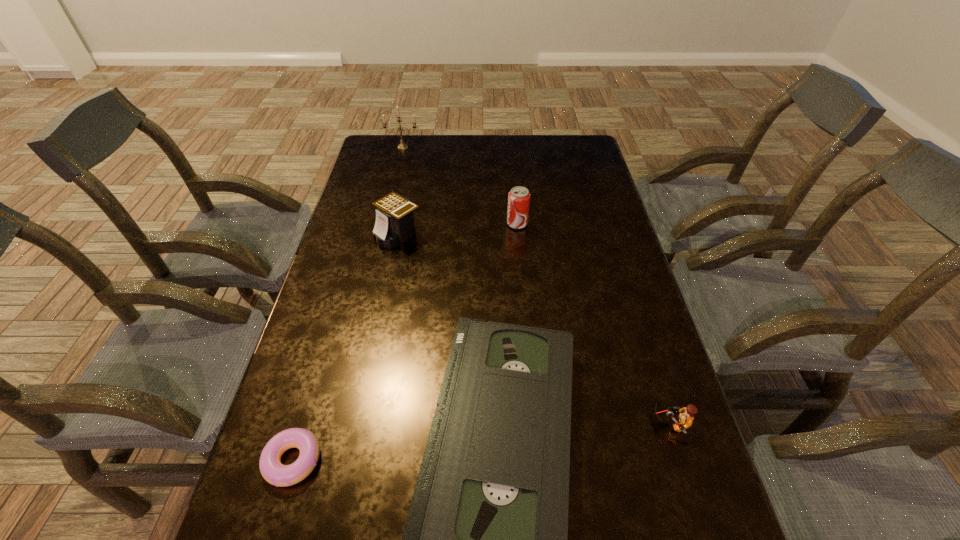
At what (x,y) coordinates should I click in order to perform the action: click on free spot located 0.280m holding a crossbow in the hands of the Lego. Please return your answer as a coordinate pair (x, y). The image size is (960, 540). Looking at the image, I should click on (523, 423).

What are the coordinates of `free spot located holding a crossbow in the hands of the Lego` in the screenshot? It's located at (598, 423).

Image resolution: width=960 pixels, height=540 pixels. Find the location of `free space located 0.190m on the back of the shortest object`. free space located 0.190m on the back of the shortest object is located at coordinates (324, 356).

At what (x,y) coordinates should I click in order to perform the action: click on object located at the far edge. Please return your answer as a coordinate pair (x, y). The height and width of the screenshot is (540, 960). Looking at the image, I should click on (402, 146).

Identify the location of candle that is positioned at the left edge. This screenshot has height=540, width=960. (402, 146).

Find the location of `calculator situated at the left edge`. calculator situated at the left edge is located at coordinates (394, 224).

Locate an element on the screen. This screenshot has width=960, height=540. doughnut that is at the left edge is located at coordinates (273, 471).

I want to click on object that is at the right edge, so click(x=686, y=418).

The height and width of the screenshot is (540, 960). I want to click on object located in the far left corner section of the desktop, so click(402, 146).

In the image, there is a desktop. Find the location of `free region at the far edge`. free region at the far edge is located at coordinates (470, 165).